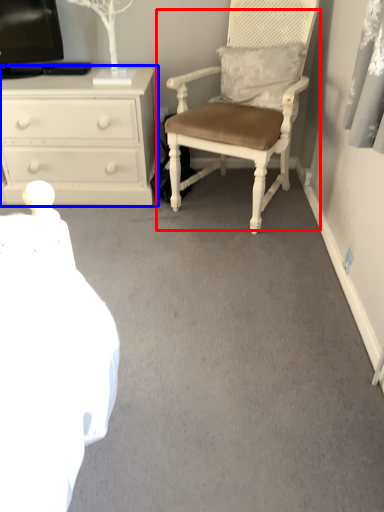
Question: Which of the following is the farthest to the observer, chair (highlighted by a red box) or chest of drawers (highlighted by a blue box)?

Choices:
 (A) chair
 (B) chest of drawers

Answer: (B)